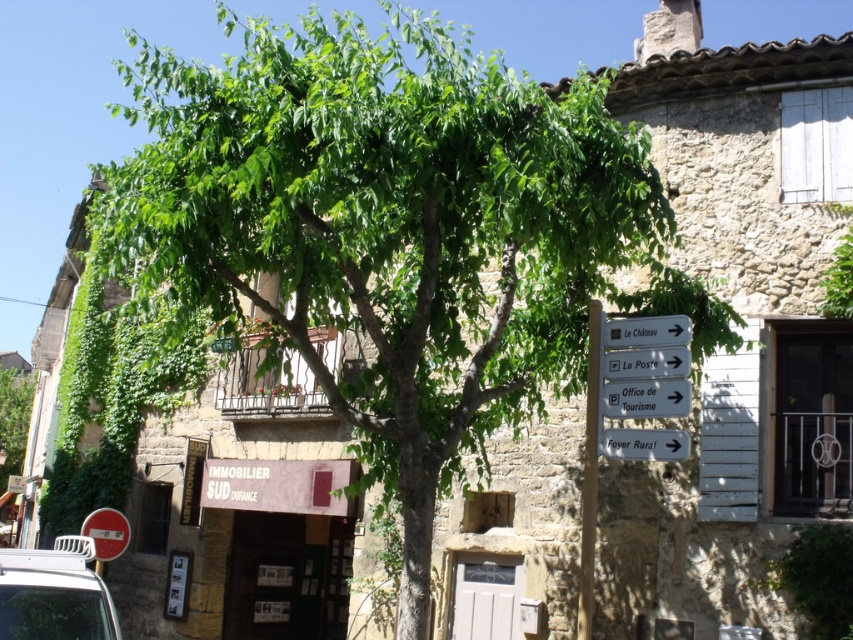
Question: Observing the image, what is the correct spatial positioning of green leafy tree at center in reference to white plastic signpost at upper center?

Choices:
 (A) right
 (B) left

Answer: (B)

Question: Does white plastic sign at center come in front of green leafy tree at center?

Choices:
 (A) no
 (B) yes

Answer: (B)

Question: Is the position of green leafy tree at center less distant than that of metallic circular sign at lower left?

Choices:
 (A) no
 (B) yes

Answer: (A)

Question: Which of the following is the closest to the observer?

Choices:
 (A) (677, 445)
 (B) (679, 326)
 (C) (7, 388)
 (D) (642, 376)

Answer: (A)

Question: Which object appears farthest from the camera in this image?

Choices:
 (A) white plastic sign at center
 (B) white plastic sign at lower right

Answer: (A)

Question: Among these points, which one is farthest from the camera?

Choices:
 (A) (647, 387)
 (B) (631, 336)

Answer: (B)